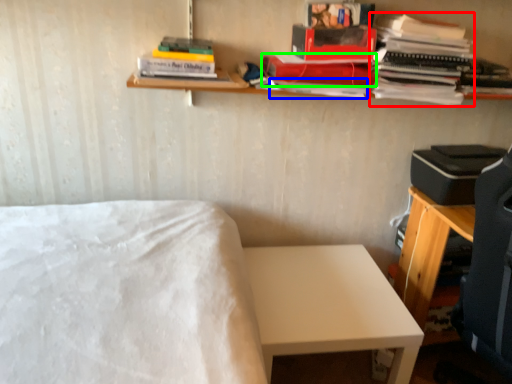
Question: Considering the real-world distances, which object is farthest from book (highlighted by a red box)? paperback book (highlighted by a blue box) or paperback book (highlighted by a green box)?

Choices:
 (A) paperback book
 (B) paperback book

Answer: (A)